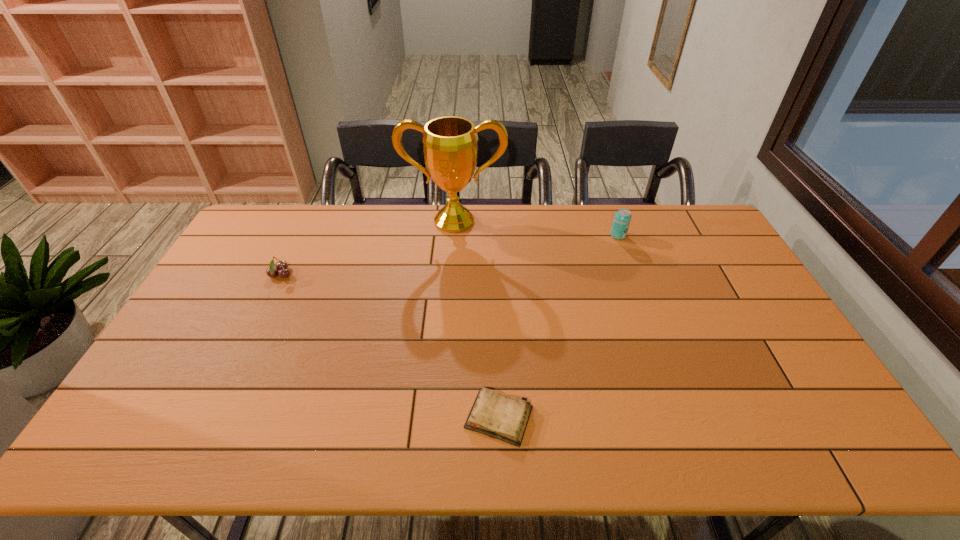
Select which object appears as the third closest to the tallest object. Please provide its 2D coordinates. Your answer should be formatted as a tuple, i.e. [(x, y)], where the tuple contains the x and y coordinates of a point satisfying the conditions above.

[(498, 416)]

Select which object appears as the closest to the shortest object. Please provide its 2D coordinates. Your answer should be formatted as a tuple, i.e. [(x, y)], where the tuple contains the x and y coordinates of a point satisfying the conditions above.

[(450, 146)]

The image size is (960, 540). Find the location of `free space that satisfies the following two spatial constraints: 1. on the front-facing side of the award; 2. on the right side of the beer can`. free space that satisfies the following two spatial constraints: 1. on the front-facing side of the award; 2. on the right side of the beer can is located at coordinates (453, 235).

Identify the location of blank area in the image that satisfies the following two spatial constraints: 1. on the leaves of the diary; 2. on the left side of the third farthest object. The width and height of the screenshot is (960, 540). (212, 417).

The height and width of the screenshot is (540, 960). Identify the location of blank space that satisfies the following two spatial constraints: 1. on the front-facing side of the award; 2. on the leaves of the second nearest object. (450, 275).

Where is `vacant space that satisfies the following two spatial constraints: 1. on the front-facing side of the tallest object; 2. on the leaves of the leftmost object`? The image size is (960, 540). vacant space that satisfies the following two spatial constraints: 1. on the front-facing side of the tallest object; 2. on the leaves of the leftmost object is located at coordinates (450, 275).

Locate an element on the screen. vacant region that satisfies the following two spatial constraints: 1. on the leaves of the nearest object; 2. on the left side of the second shortest object is located at coordinates (212, 417).

This screenshot has height=540, width=960. What are the coordinates of `vacant space that satisfies the following two spatial constraints: 1. on the front side of the rightmost object; 2. on the leaves of the third tallest object` in the screenshot? It's located at (633, 275).

This screenshot has width=960, height=540. What are the coordinates of `vacant space that satisfies the following two spatial constraints: 1. on the leaves of the diary; 2. on the left side of the third tallest object` in the screenshot? It's located at (212, 417).

Find the location of a particular element. The image size is (960, 540). free spot that satisfies the following two spatial constraints: 1. on the front-facing side of the tallest object; 2. on the leaves of the cherry is located at coordinates (450, 275).